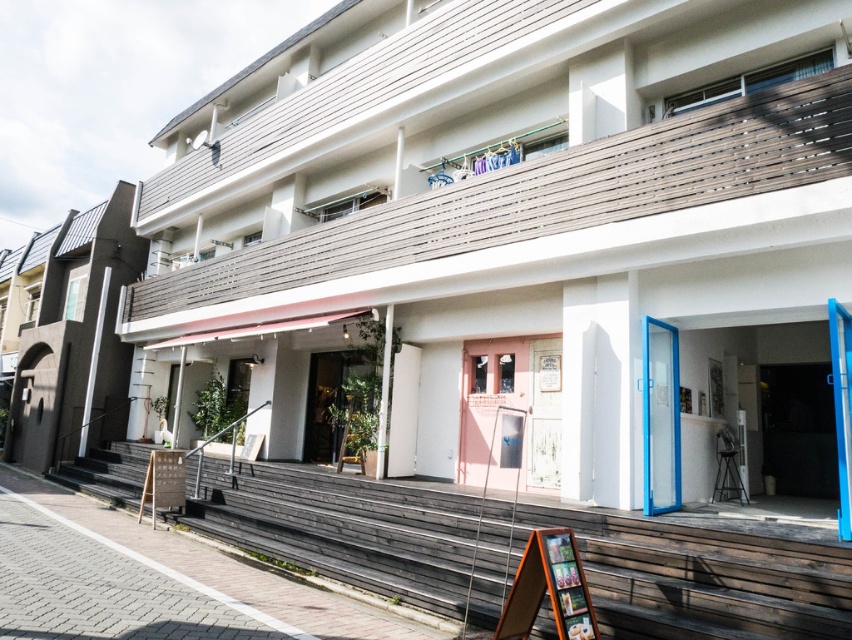
Question: Estimate the real-world distances between objects in this image. Which object is closer to the blue glass door at center?

Choices:
 (A) white matte building at center
 (B) wooden stairs at lower left
 (C) pink matte door at center

Answer: (B)

Question: From the image, what is the correct spatial relationship of dark gray concrete building at left in relation to blue glass door at center?

Choices:
 (A) above
 (B) below

Answer: (A)

Question: Does wooden stairs at lower left come behind blue glass door at center?

Choices:
 (A) no
 (B) yes

Answer: (A)

Question: Which is nearer to the white matte building at center?

Choices:
 (A) wooden stairs at lower left
 (B) dark gray concrete building at left

Answer: (A)

Question: Among these objects, which one is farthest from the camera?

Choices:
 (A) dark gray concrete building at left
 (B) blue glass door at center
 (C) white matte building at center
 (D) pink matte door at center

Answer: (A)

Question: Does dark gray concrete building at left come behind pink matte door at center?

Choices:
 (A) yes
 (B) no

Answer: (A)